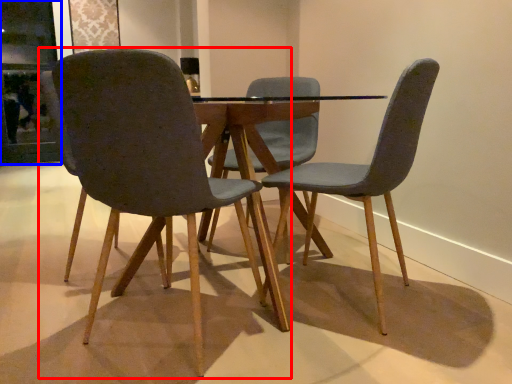
Question: Which object is closer to the camera taking this photo, chair (highlighted by a red box) or glass door (highlighted by a blue box)?

Choices:
 (A) chair
 (B) glass door

Answer: (A)